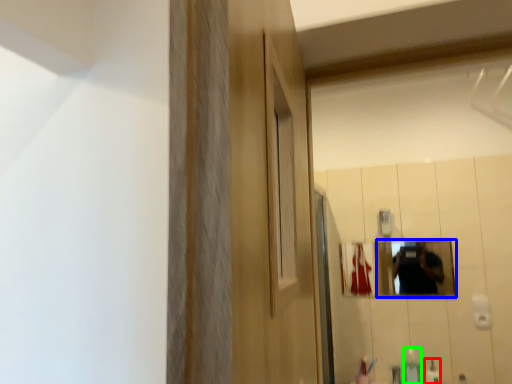
Question: Which object is the closest to the mouthwash (highlighted by a red box)? Choose among these: mirror (highlighted by a blue box) or soap dispenser (highlighted by a green box).

Choices:
 (A) mirror
 (B) soap dispenser

Answer: (B)